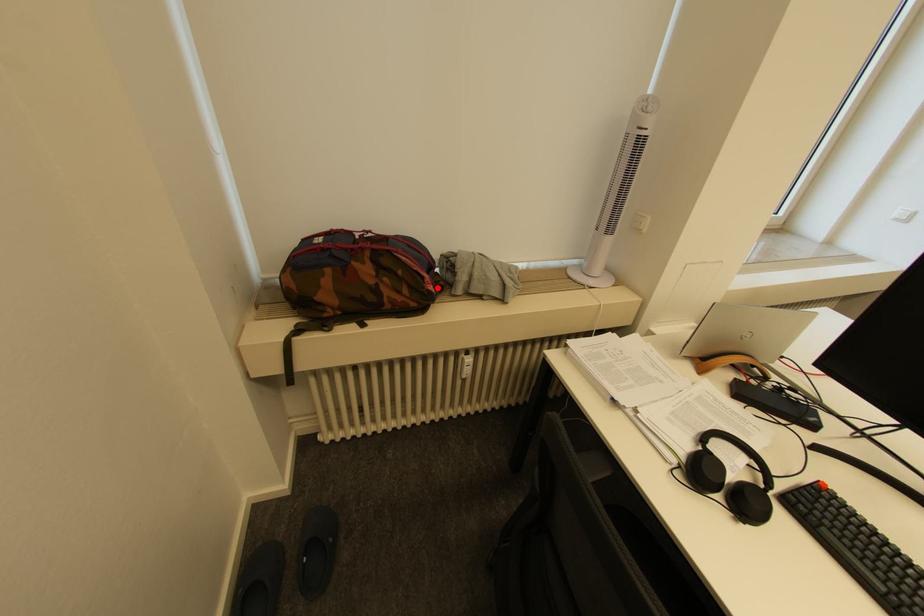
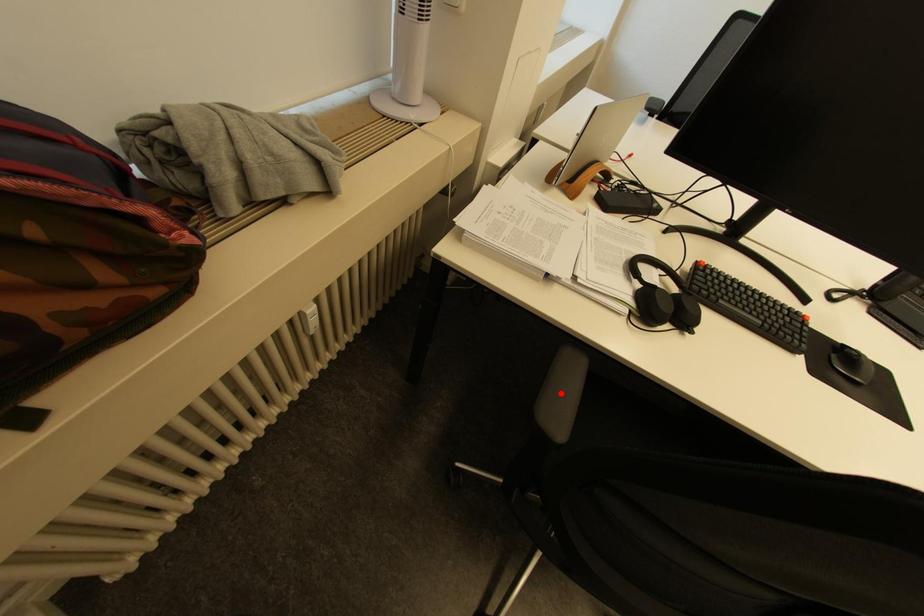
I am providing you with two images of the same scene from different viewpoints. A red point is marked on the first image and another point is marked on the second image. Is the marked point in image1 the same physical position as the marked point in image2?

No